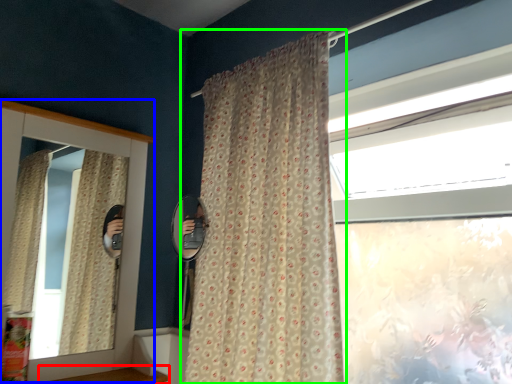
Question: Which is farther away from window sill (highlighted by a red box)? medicine cabinet (highlighted by a blue box) or curtain (highlighted by a green box)?

Choices:
 (A) medicine cabinet
 (B) curtain

Answer: (B)